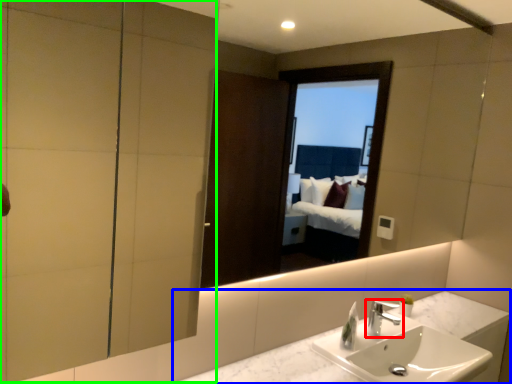
Question: Considering the real-world distances, which object is closest to tap (highlighted by a red box)? counter top (highlighted by a blue box) or screen door (highlighted by a green box).

Choices:
 (A) counter top
 (B) screen door

Answer: (A)